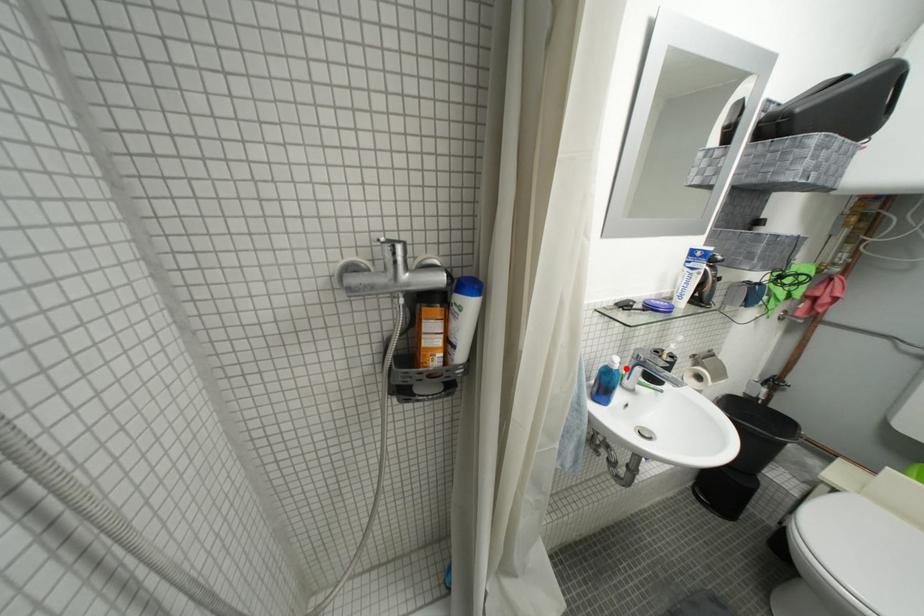
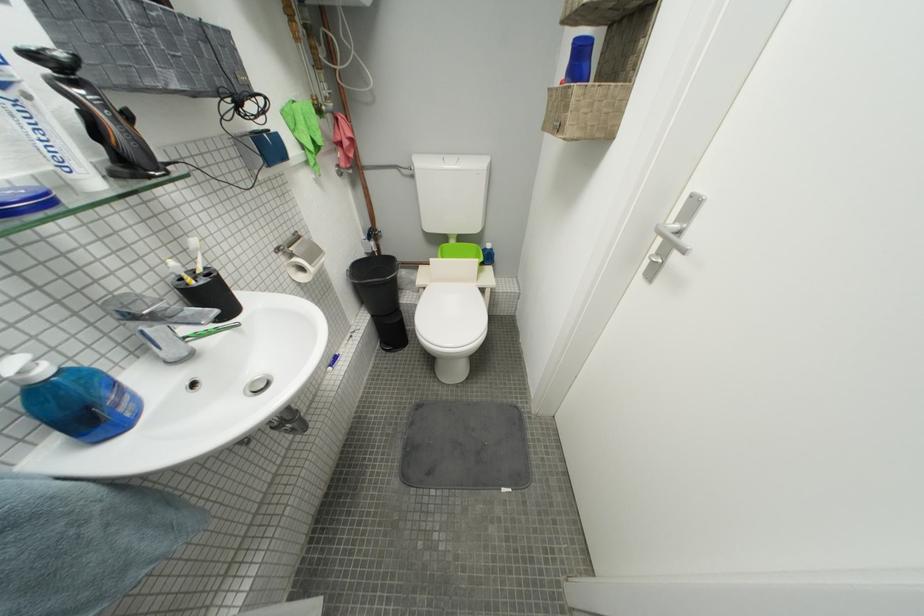
The point at the highlighted location is marked in the first image. Where is the corresponding point in the second image?

(53, 374)